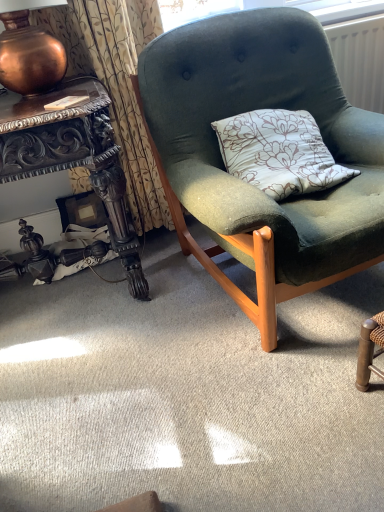
Question: Is polished dark wood desk at left positioned beyond the bounds of textured beige curtain at upper left?

Choices:
 (A) no
 (B) yes

Answer: (B)

Question: From a real-world perspective, does polished dark wood desk at left sit lower than textured beige curtain at upper left?

Choices:
 (A) yes
 (B) no

Answer: (A)

Question: Is polished dark wood desk at left thinner than textured beige curtain at upper left?

Choices:
 (A) no
 (B) yes

Answer: (A)

Question: Can you confirm if polished dark wood desk at left is wider than textured beige curtain at upper left?

Choices:
 (A) no
 (B) yes

Answer: (B)

Question: From a real-world perspective, is polished dark wood desk at left physically above textured beige curtain at upper left?

Choices:
 (A) yes
 (B) no

Answer: (B)

Question: Is point (34, 83) closer or farther from the camera than point (39, 141)?

Choices:
 (A) closer
 (B) farther

Answer: (B)

Question: From a real-world perspective, relative to polished dark wood desk at left, is copper metallic lamp at upper left vertically above or below?

Choices:
 (A) above
 (B) below

Answer: (A)

Question: In the image, is copper metallic lamp at upper left on the left side or the right side of polished dark wood desk at left?

Choices:
 (A) right
 (B) left

Answer: (A)

Question: In the image, is copper metallic lamp at upper left positioned in front of or behind polished dark wood desk at left?

Choices:
 (A) behind
 (B) front

Answer: (A)

Question: Looking at their shapes, would you say white plastic radiator at upper right is wider or thinner than copper metallic lamp at upper left?

Choices:
 (A) thin
 (B) wide

Answer: (A)

Question: From a real-world perspective, relative to copper metallic lamp at upper left, is white plastic radiator at upper right vertically above or below?

Choices:
 (A) below
 (B) above

Answer: (A)

Question: Considering the positions of white plastic radiator at upper right and copper metallic lamp at upper left in the image, is white plastic radiator at upper right taller or shorter than copper metallic lamp at upper left?

Choices:
 (A) tall
 (B) short

Answer: (A)

Question: Choose the correct answer: Is white plastic radiator at upper right inside copper metallic lamp at upper left or outside it?

Choices:
 (A) outside
 (B) inside

Answer: (A)

Question: Visually, is velvet green chair at center positioned to the left or to the right of copper metallic lamp at upper left?

Choices:
 (A) left
 (B) right

Answer: (B)

Question: Is velvet green chair at center wider or thinner than copper metallic lamp at upper left?

Choices:
 (A) thin
 (B) wide

Answer: (B)